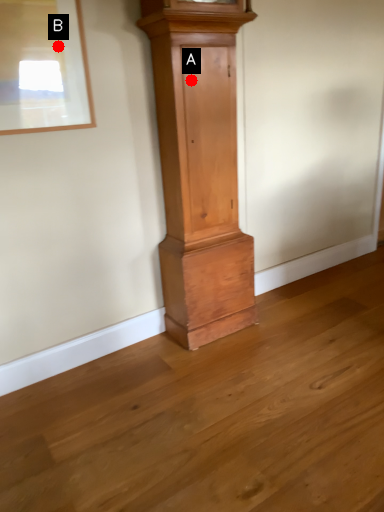
Question: Two points are circled on the image, labeled by A and B beside each circle. Which point is farther to the camera?

Choices:
 (A) A is further
 (B) B is further

Answer: (A)